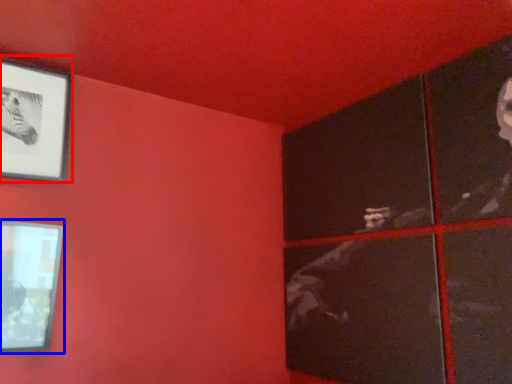
Question: Which object is closer to the camera taking this photo, picture frame (highlighted by a red box) or picture frame (highlighted by a blue box)?

Choices:
 (A) picture frame
 (B) picture frame

Answer: (B)